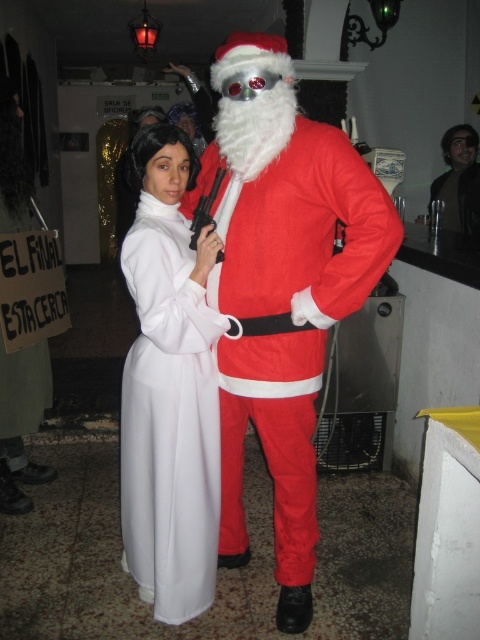
You are standing in the middle of the room and want to move towards the two points marked in the image. Which point, point (216,488) or point (222,168), is closer to you?

Point (216,488) is closer to you because it is further to the viewer than point (222,168).

You are at a party and see the smooth black hair at upper right and the metallic silver gun at center. Which object is taller?

The smooth black hair at upper right is taller than the metallic silver gun at center.